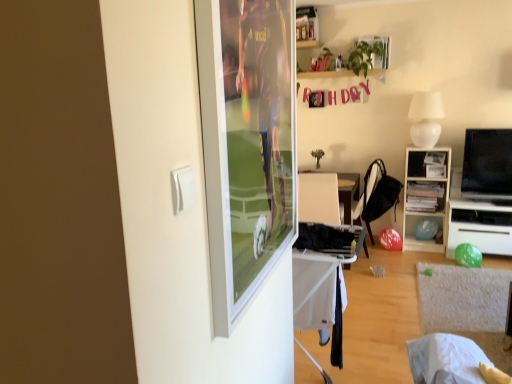
Measure the distance between point (418, 118) and camera.

→ The depth of point (418, 118) is 13.51 feet.

What do you see at coordinates (378, 194) in the screenshot? The width and height of the screenshot is (512, 384). I see `black fabric chair at center` at bounding box center [378, 194].

Describe the element at coordinates (487, 164) in the screenshot. I see `black glossy tv at right` at that location.

This screenshot has width=512, height=384. Describe the element at coordinates (307, 27) in the screenshot. I see `metallic silver shelf at upper center` at that location.

This screenshot has width=512, height=384. What are the coordinates of `black fabric laundry at center` in the screenshot? It's located at point(327,239).

Where is `wooden bookshelf at right`? wooden bookshelf at right is located at coordinates (425, 194).

Does black glossy tv at right have a greater width compared to white matte lampshade at upper right?

No, black glossy tv at right is not wider than white matte lampshade at upper right.

Who is bigger, black glossy tv at right or white matte lampshade at upper right?

Bigger between the two is white matte lampshade at upper right.

Is point (470, 163) positioned in front of point (412, 124)?

Yes.

Is wooden bookshelf at right at the back of black glossy tv at right?

No.

Can wooden bookshelf at right be found inside black glossy tv at right?

That's incorrect, wooden bookshelf at right is not inside black glossy tv at right.

Between black glossy tv at right and wooden bookshelf at right, which one is positioned in front?

black glossy tv at right.

Considering the positions of point (300, 7) and point (417, 136), is point (300, 7) closer or farther from the camera than point (417, 136)?

Point (300, 7) appears to be farther away from the viewer than point (417, 136).

From a real-world perspective, which object rests below the other?

In real-world perspective, white matte lampshade at upper right is lower.

Considering the sizes of objects metallic silver shelf at upper center and white matte lampshade at upper right in the image provided, who is wider, metallic silver shelf at upper center or white matte lampshade at upper right?

Wider between the two is white matte lampshade at upper right.

Could you tell me if metallic silver shelf at upper center is turned towards white matte lampshade at upper right?

No, metallic silver shelf at upper center is not turned towards white matte lampshade at upper right.

Is white fabric table at lower center not within wooden bookshelf at right?

Yes, white fabric table at lower center is located beyond the bounds of wooden bookshelf at right.

Consider the image. Considering the positions of objects white fabric table at lower center and wooden bookshelf at right in the image provided, who is behind, white fabric table at lower center or wooden bookshelf at right?

wooden bookshelf at right is further away from the camera.

From a real-world perspective, who is located higher, white fabric table at lower center or wooden bookshelf at right?

white fabric table at lower center.

From the image's perspective, which is above, wooden bookshelf at right or black glossy tv at right?

black glossy tv at right appears higher in the image.

Which is behind, point (435, 217) or point (501, 147)?

The point (435, 217) is behind.

How different are the orientations of wooden bookshelf at right and black glossy tv at right in degrees?

0.264 degrees.

Which object is more forward, wooden bookshelf at right or black glossy tv at right?

black glossy tv at right is more forward.

In the image, is white matte lampshade at upper right positioned in front of or behind black fabric laundry at center?

white matte lampshade at upper right is positioned farther from the viewer than black fabric laundry at center.

From their relative heights in the image, would you say white matte lampshade at upper right is taller or shorter than black fabric laundry at center?

In the image, white matte lampshade at upper right appears to be taller than black fabric laundry at center.

In terms of width, does white matte lampshade at upper right look wider or thinner when compared to black fabric laundry at center?

In the image, white matte lampshade at upper right appears to be more narrow than black fabric laundry at center.

Is white matte lampshade at upper right inside or outside of black fabric laundry at center?

white matte lampshade at upper right is not enclosed by black fabric laundry at center.

From the image's perspective, is black fabric chair at center beneath white matte lampshade at upper right?

Indeed, from the image's perspective, black fabric chair at center is shown beneath white matte lampshade at upper right.

Based on the photo, between black fabric chair at center and white matte lampshade at upper right, which one has less height?

white matte lampshade at upper right is shorter.

Can we say black fabric chair at center lies outside white matte lampshade at upper right?

Yes, black fabric chair at center is located beyond the bounds of white matte lampshade at upper right.

Relative to white matte lampshade at upper right, is black fabric chair at center in front or behind?

In the image, black fabric chair at center appears behind white matte lampshade at upper right.

The width and height of the screenshot is (512, 384). I want to click on lamp on the left side of black glossy tv at right, so click(426, 118).

The height and width of the screenshot is (384, 512). What are the coordinates of `television above the wooden bookshelf at right (from the image's perspective)` in the screenshot? It's located at coord(487,164).

Consider the image. When comparing their distances from white fabric table at lower center, does black fabric laundry at center or black fabric chair at center seem closer?

black fabric laundry at center lies closer to white fabric table at lower center than the other object.

From the image, which object appears to be nearer to white fabric table at lower center, wooden bookshelf at right or white matte lampshade at upper right?

Among the two, wooden bookshelf at right is located nearer to white fabric table at lower center.

When comparing their distances from metallic silver shelf at upper center, does black fabric chair at center or white matte lampshade at upper right seem further?

Based on the image, black fabric chair at center appears to be further to metallic silver shelf at upper center.

Estimate the real-world distances between objects in this image. Which object is further from black fabric laundry at center, white matte lampshade at upper right or black fabric chair at center?

white matte lampshade at upper right lies further to black fabric laundry at center than the other object.

Based on their spatial positions, is black fabric chair at center or black fabric laundry at center closer to white matte lampshade at upper right?

black fabric chair at center.

From the image, which object appears to be nearer to black glossy tv at right, black fabric chair at center or white fabric table at lower center?

black fabric chair at center is positioned closer to the anchor black glossy tv at right.

From the image, which object appears to be farther from black fabric laundry at center, wooden bookshelf at right or black fabric chair at center?

The object further to black fabric laundry at center is wooden bookshelf at right.

In the scene shown: Estimate the real-world distances between objects in this image. Which object is further from wooden bookshelf at right, black fabric laundry at center or white fabric table at lower center?

black fabric laundry at center is positioned further to the anchor wooden bookshelf at right.

Locate an element on the screen. Image resolution: width=512 pixels, height=384 pixels. lamp located between black fabric laundry at center and metallic silver shelf at upper center in the depth direction is located at coordinates (426, 118).

The width and height of the screenshot is (512, 384). In order to click on lamp between metallic silver shelf at upper center and black fabric chair at center vertically in this screenshot , I will do [x=426, y=118].

Where is `chair between metallic silver shelf at upper center and wooden bookshelf at right in the up-down direction`? This screenshot has width=512, height=384. chair between metallic silver shelf at upper center and wooden bookshelf at right in the up-down direction is located at coordinates (378, 194).

At what (x,y) coordinates should I click in order to perform the action: click on cabinetry located between black fabric chair at center and black glossy tv at right in the left-right direction. Please return your answer as a coordinate pair (x, y). Looking at the image, I should click on tap(425, 194).